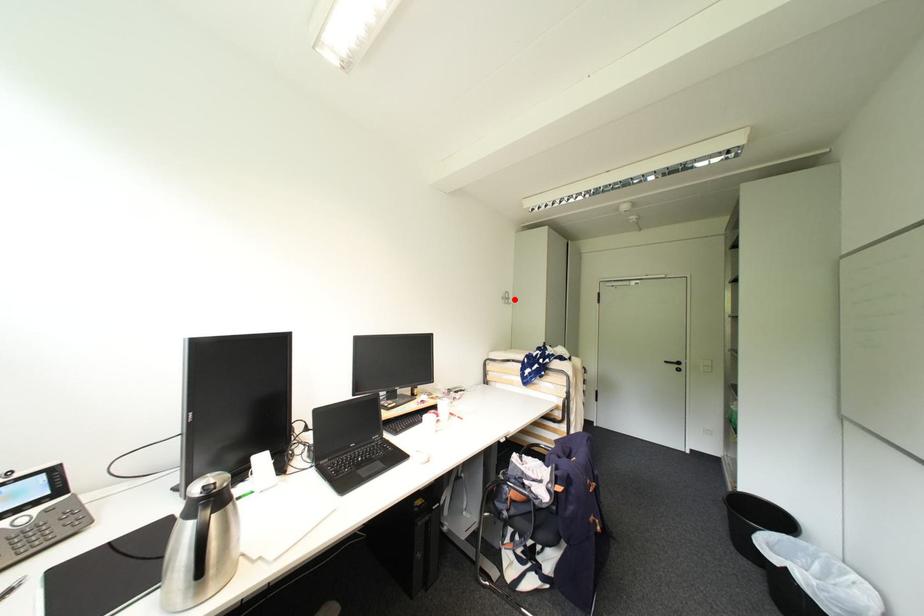
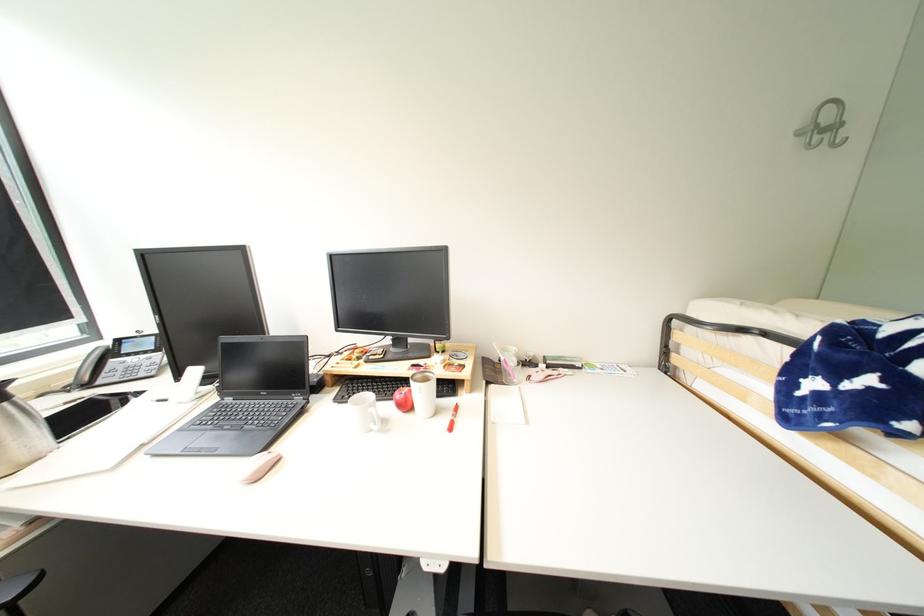
Where in the second image is the point corresponding to the highlighted location from the first image?

(841, 128)